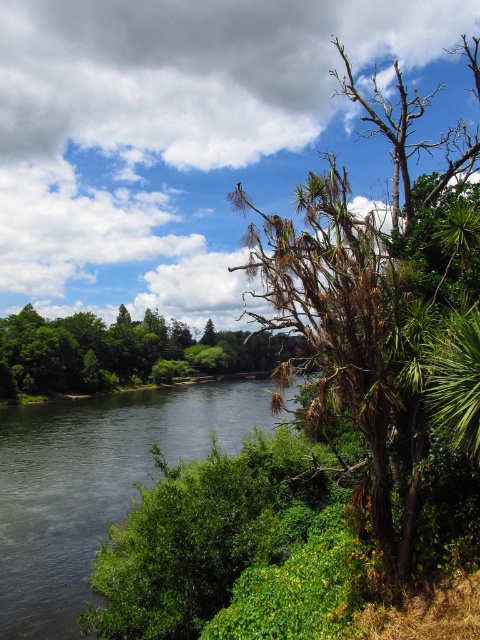
You are standing at the point labeled point (404, 278) and want to walk to the point labeled point (126, 426). Which direction should you move to get closer to your destination?

You should move away from the camera because point (126, 426) is further from the camera than point (404, 278).

You are standing at the center of the river in the image. Looking towards the right bank, you see a brown dried wood tree. Can you determine if the tree is located to the north or south of the point marked at coordinate (x=382, y=308)?

The point marked at coordinate (x=382, y=308) marks the brown dried wood tree at right, so the tree is exactly at that point. Therefore, it is neither north nor south of the marked point.